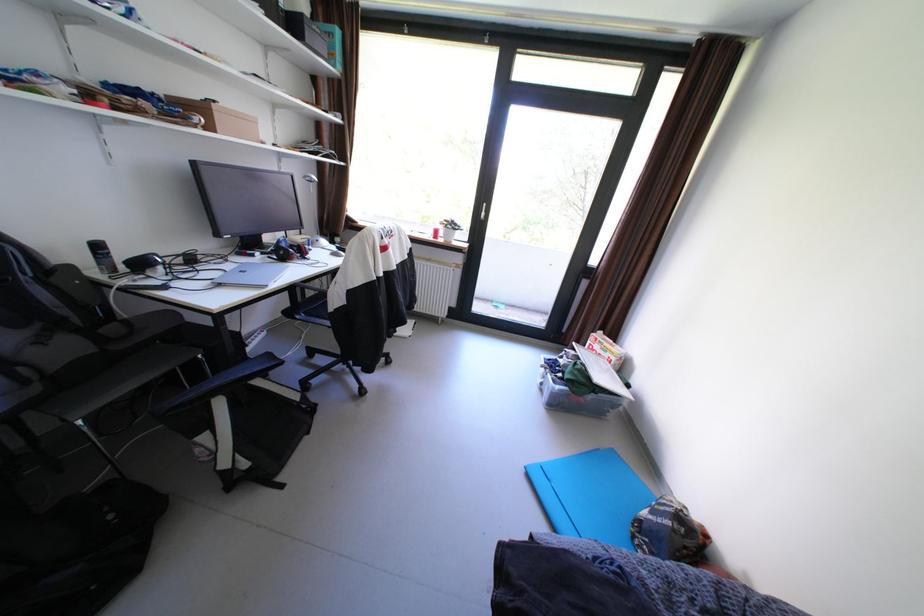
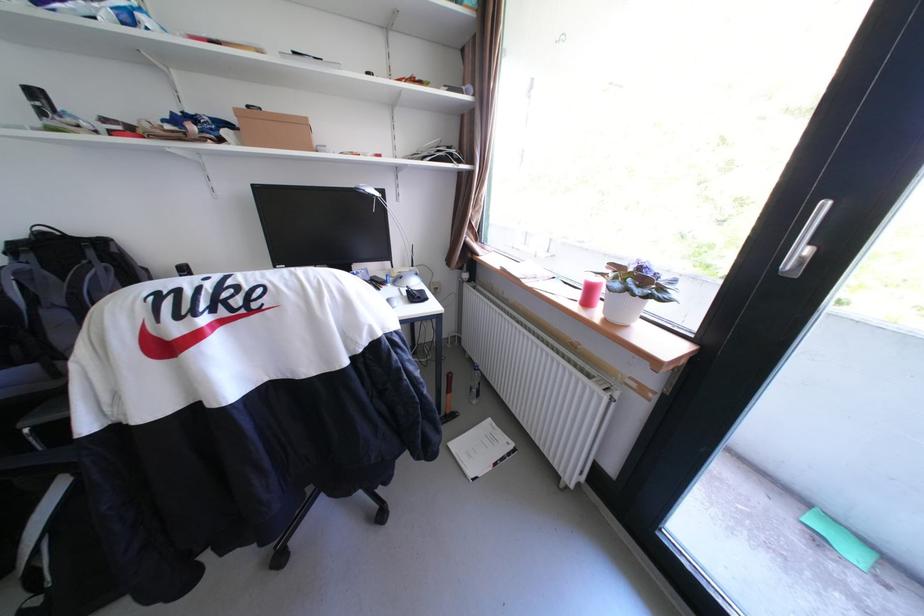
Find the pixel in the second image that matches point (452, 240) in the first image.

(608, 313)